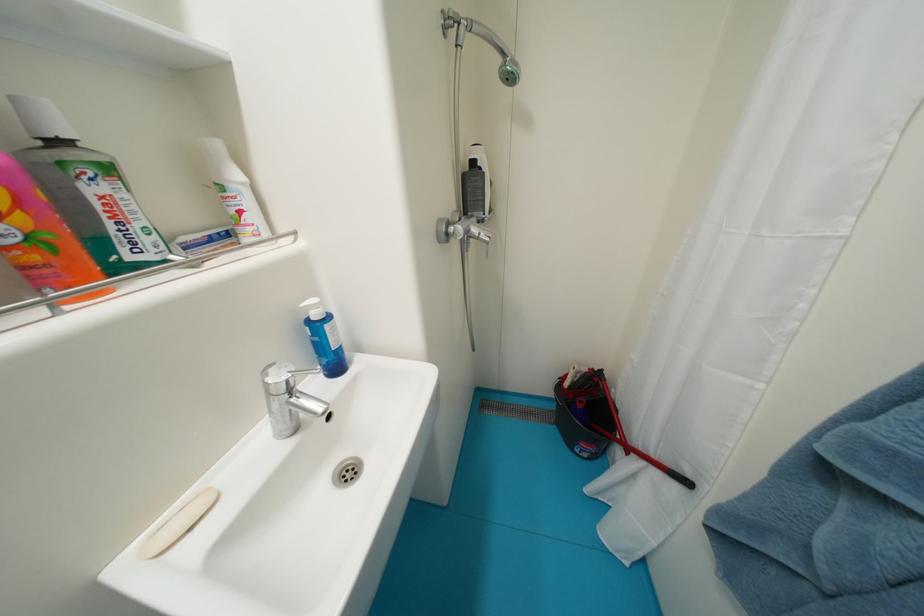
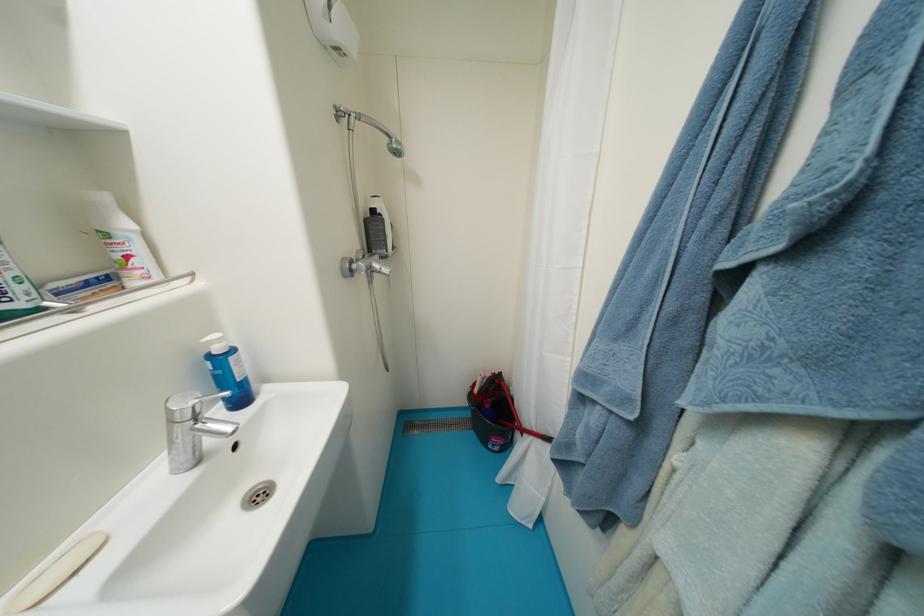
The point at (x=188, y=241) is marked in the first image. Where is the corresponding point in the second image?

(61, 286)